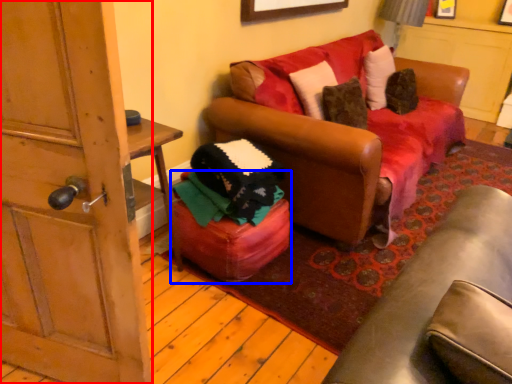
Question: Which of the following is the closest to the observer, door (highlighted by a red box) or stool (highlighted by a blue box)?

Choices:
 (A) door
 (B) stool

Answer: (A)